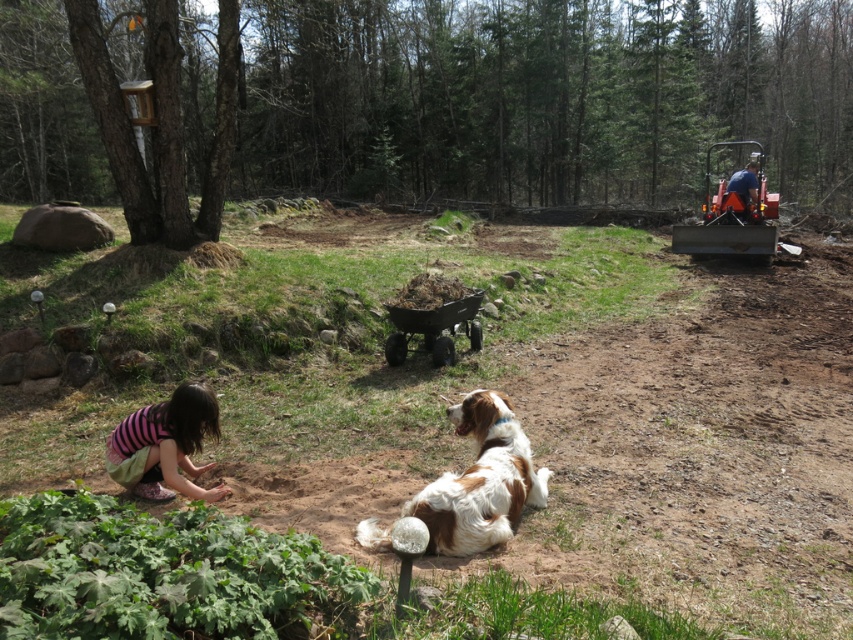
Question: Does striped fabric child at lower left appear on the right side of blue fabric at upper right?

Choices:
 (A) no
 (B) yes

Answer: (A)

Question: Considering the relative positions of brown and white fur at center and blue fabric at upper right in the image provided, where is brown and white fur at center located with respect to blue fabric at upper right?

Choices:
 (A) above
 (B) below

Answer: (B)

Question: Observing the image, what is the correct spatial positioning of striped fabric child at lower left in reference to blue fabric at upper right?

Choices:
 (A) right
 (B) left

Answer: (B)

Question: Among these points, which one is nearest to the camera?

Choices:
 (A) (177, 456)
 (B) (505, 529)

Answer: (B)

Question: Which point is farther to the camera?

Choices:
 (A) blue fabric at upper right
 (B) brown and white fur at center

Answer: (A)

Question: Which point is farther to the camera?

Choices:
 (A) brown and white fur at center
 (B) blue fabric at upper right
 (C) striped fabric child at lower left

Answer: (B)